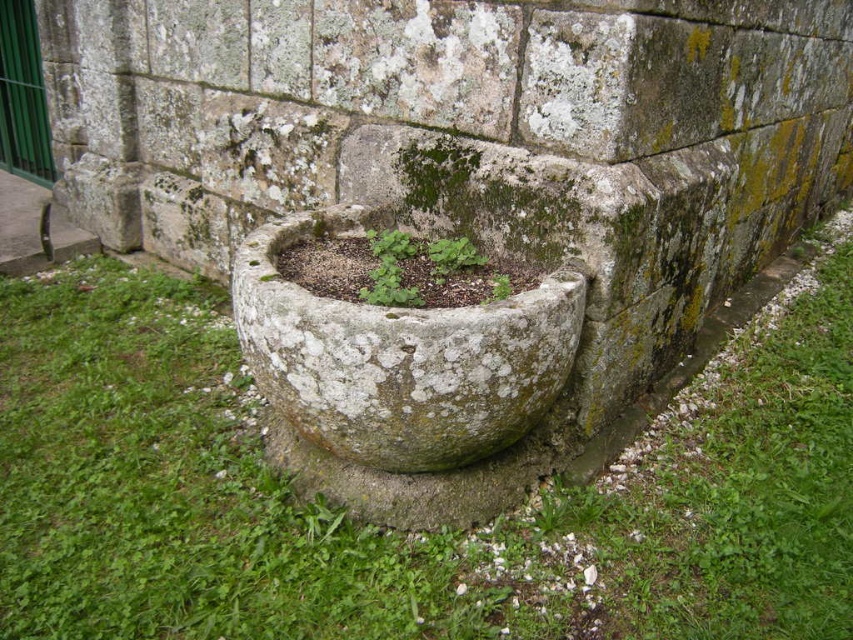
You are standing in front of a stone planter against a weathered stone wall. You notice a point marked at coordinates (403, 532). Based on the scene description, what does this point most likely indicate?

The point at (403, 532) marks the location of the green mossy stone at center.